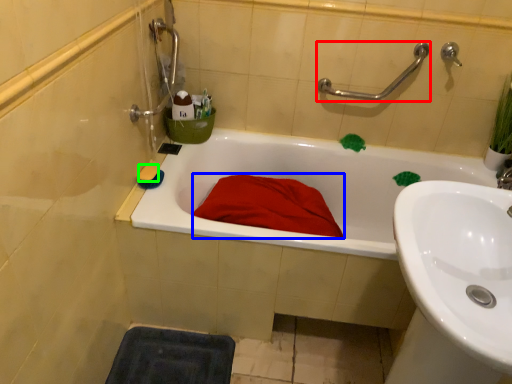
Question: Which object is the closest to the shower (highlighted by a red box)? Choose among these: blanket (highlighted by a blue box) or soap (highlighted by a green box).

Choices:
 (A) blanket
 (B) soap

Answer: (A)